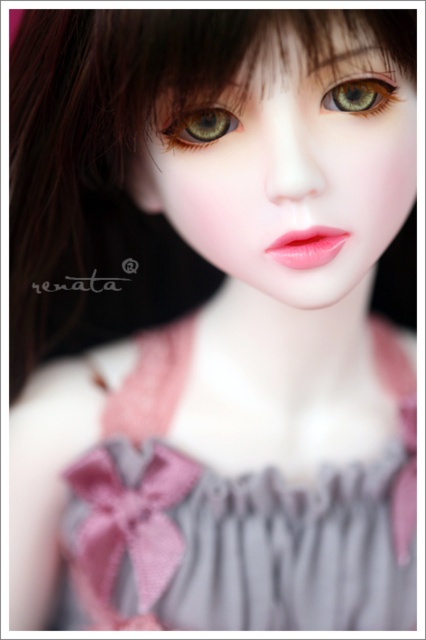
You are a fashion designer preparing to place a small brooch on the doll. The brooch is 2 cm tall. Considering the doll has a pink satin dress at center and a green matte eye at center, which object can accommodate the brooch in terms of height?

The pink satin dress at center has a greater height compared to the green matte eye at center, so the brooch can be placed on the pink satin dress at center.